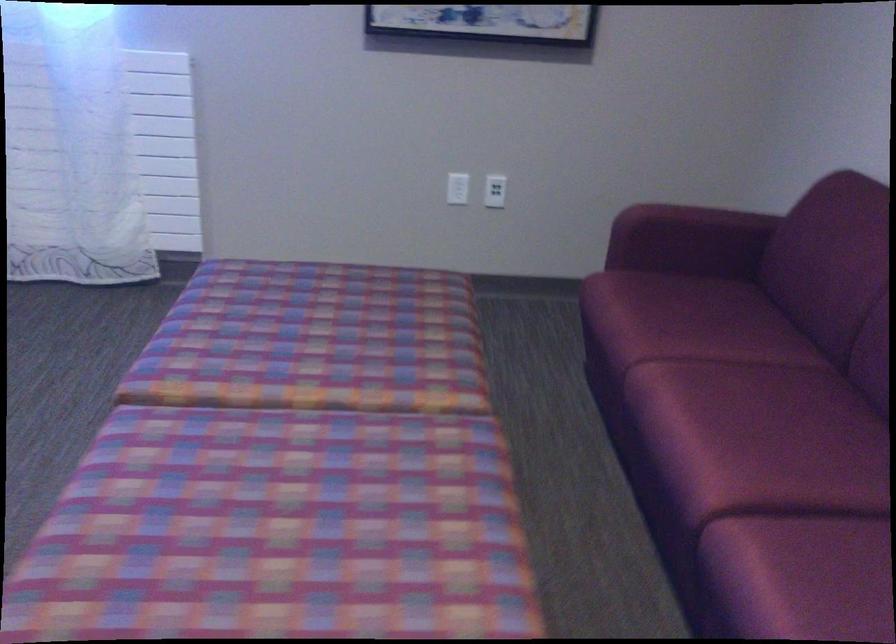
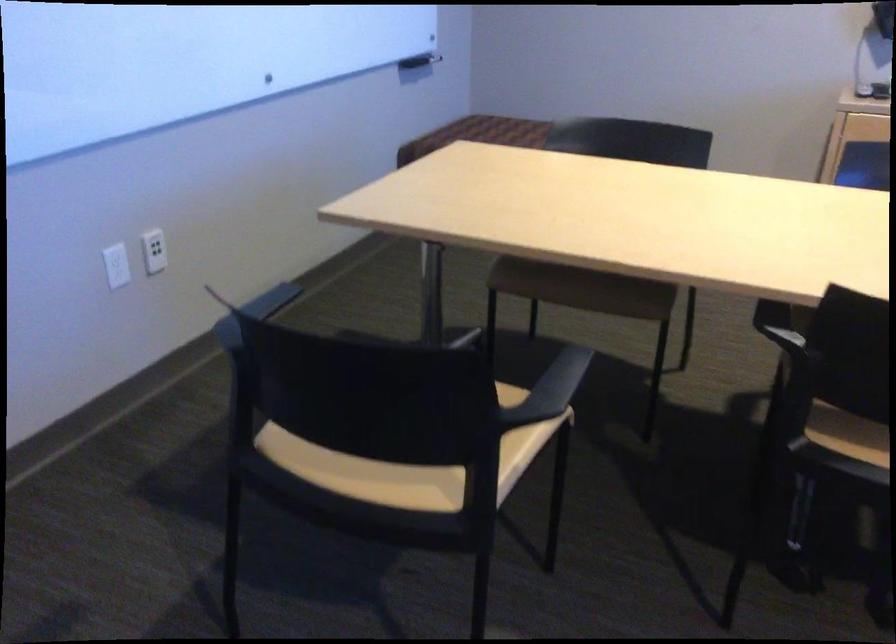
Based on the continuous images, in which direction is the camera rotating?

The rotation direction of the camera is left-down.